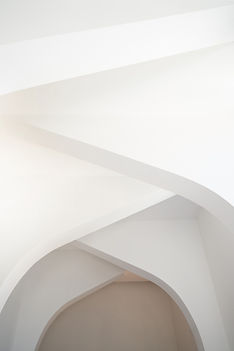
Locate an element on the screen. This screenshot has height=351, width=234. second lowest shelf is located at coordinates (184, 272).